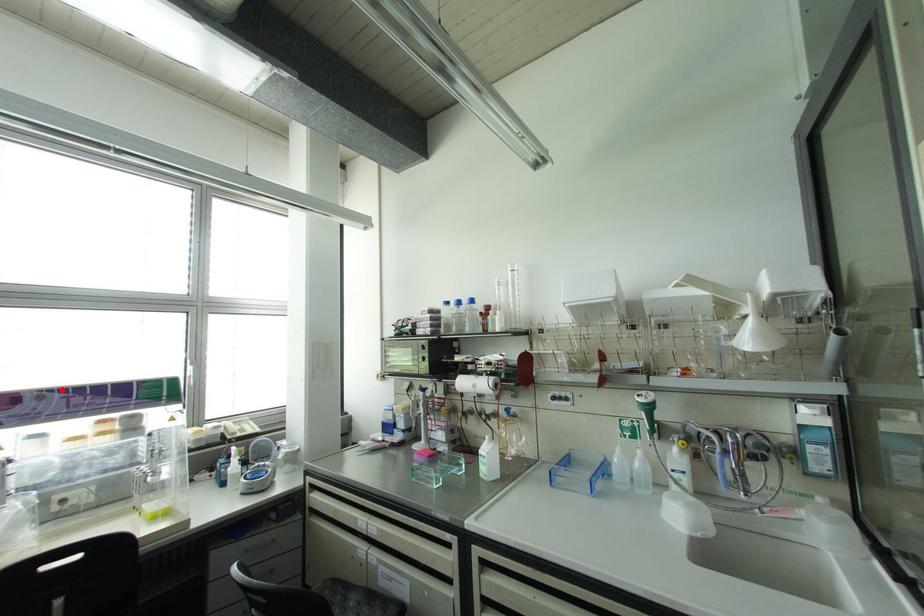
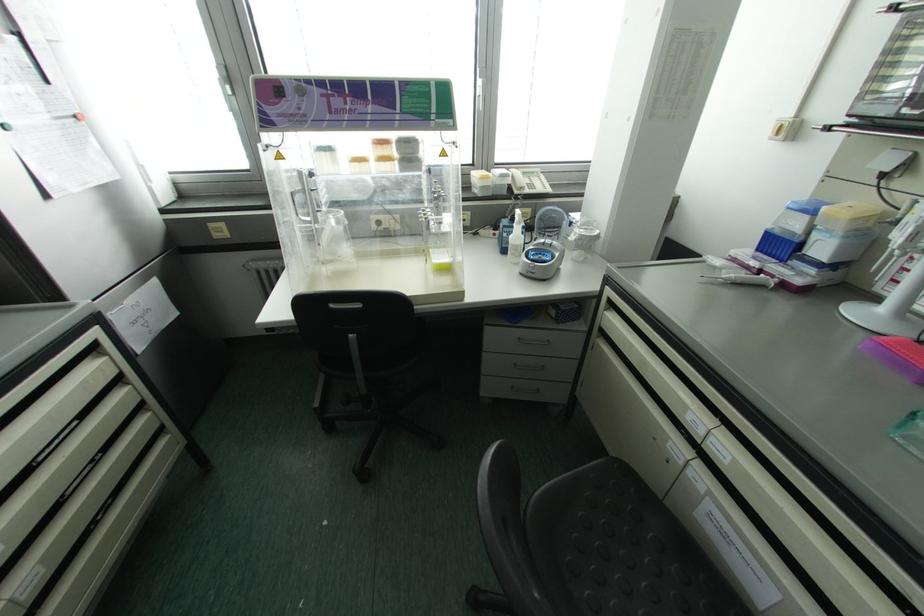
Where in the second image is the point corresponding to the highlighted location from the first image?

(320, 82)